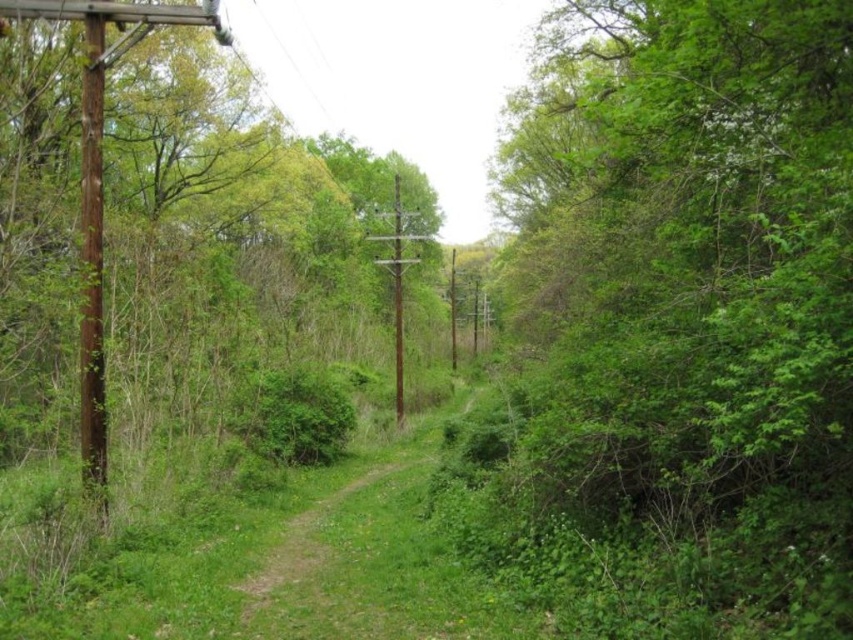
Question: Which is nearer to the green grassy trail at center?

Choices:
 (A) green leafy bush at right
 (B) brown wooden pole at left

Answer: (B)

Question: Is green leafy bush at right to the right of green leafy tree at left from the viewer's perspective?

Choices:
 (A) yes
 (B) no

Answer: (A)

Question: Which object is positioned farthest from the green leafy bush at right?

Choices:
 (A) green grassy trail at center
 (B) brown wooden pole at left
 (C) brown wooden telegraph pole at center

Answer: (B)

Question: Does green leafy bush at right appear over green leafy tree at left?

Choices:
 (A) yes
 (B) no

Answer: (A)

Question: Can you confirm if green leafy bush at right is wider than green grassy trail at center?

Choices:
 (A) no
 (B) yes

Answer: (B)

Question: Which is nearer to the green leafy bush at right?

Choices:
 (A) green leafy tree at left
 (B) brown wooden pole at left

Answer: (A)